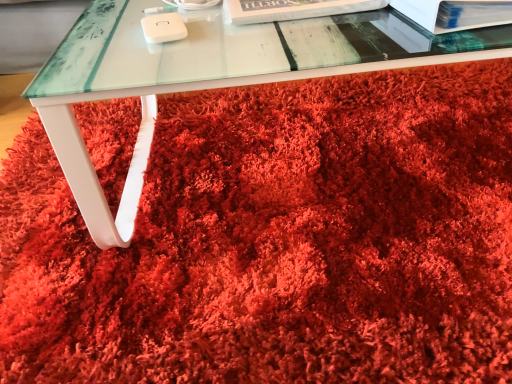
Question: Can you confirm if white paper at upper center, arranged as the second paperback book when viewed from the right, is smaller than transparent glass table at center?

Choices:
 (A) no
 (B) yes

Answer: (B)

Question: Does white paper at upper center, arranged as the second paperback book when viewed from the right, come behind transparent glass table at center?

Choices:
 (A) no
 (B) yes

Answer: (B)

Question: Is white paper at upper center, which ranks as the first paperback book in left-to-right order, next to transparent glass table at center?

Choices:
 (A) yes
 (B) no

Answer: (B)

Question: Considering the relative positions of white paper at upper center, arranged as the second paperback book when viewed from the right, and transparent glass table at center in the image provided, is white paper at upper center, arranged as the second paperback book when viewed from the right, in front of transparent glass table at center?

Choices:
 (A) no
 (B) yes

Answer: (A)

Question: Is there a large distance between white paper at upper center, arranged as the second paperback book when viewed from the right, and transparent glass table at center?

Choices:
 (A) no
 (B) yes

Answer: (A)

Question: Is transparent glass table at center located within white paper at upper center, which ranks as the first paperback book in left-to-right order?

Choices:
 (A) yes
 (B) no

Answer: (B)

Question: Is white glossy paperback book at upper right, acting as the first paperback book starting from the right, bigger than transparent glass table at center?

Choices:
 (A) no
 (B) yes

Answer: (A)

Question: From the image's perspective, is white glossy paperback book at upper right, acting as the 2th paperback book starting from the left, beneath transparent glass table at center?

Choices:
 (A) no
 (B) yes

Answer: (B)

Question: From a real-world perspective, is white glossy paperback book at upper right, acting as the 2th paperback book starting from the left, over transparent glass table at center?

Choices:
 (A) no
 (B) yes

Answer: (B)

Question: Is white glossy paperback book at upper right, acting as the 2th paperback book starting from the left, at the left side of transparent glass table at center?

Choices:
 (A) no
 (B) yes

Answer: (A)

Question: Considering the relative sizes of white glossy paperback book at upper right, acting as the first paperback book starting from the right, and transparent glass table at center in the image provided, is white glossy paperback book at upper right, acting as the first paperback book starting from the right, taller than transparent glass table at center?

Choices:
 (A) no
 (B) yes

Answer: (B)

Question: Is white glossy paperback book at upper right, acting as the first paperback book starting from the right, to the right of transparent glass table at center from the viewer's perspective?

Choices:
 (A) yes
 (B) no

Answer: (A)

Question: From a real-world perspective, is white paper at upper center, arranged as the second paperback book when viewed from the right, positioned over white glossy paperback book at upper right, acting as the 2th paperback book starting from the left, based on gravity?

Choices:
 (A) yes
 (B) no

Answer: (B)